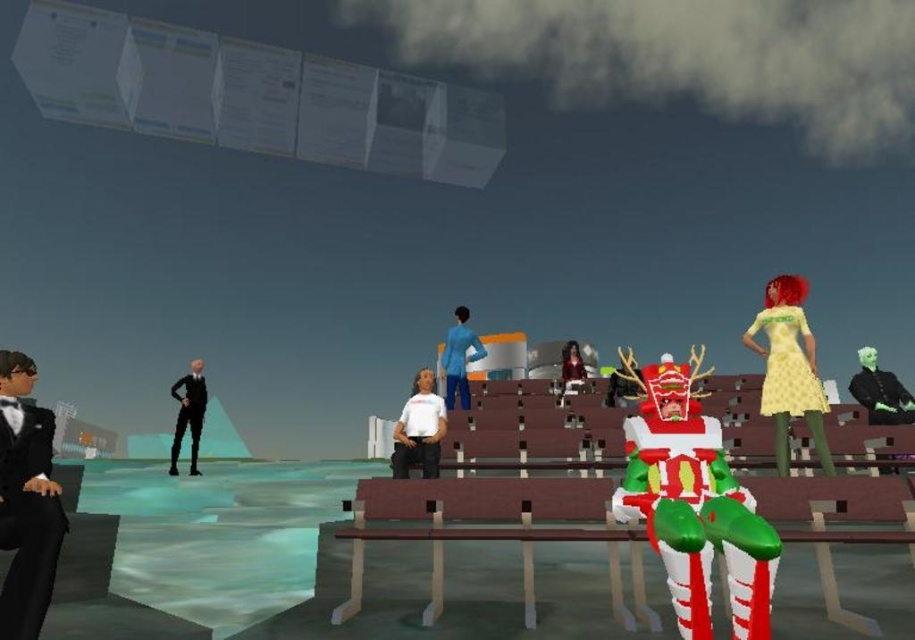
Does white matte shirt at center have a greater height compared to shiny black jacket at center?

Indeed, white matte shirt at center has a greater height compared to shiny black jacket at center.

In order to click on white matte shirt at center in this screenshot , I will do `click(418, 429)`.

Locate an element on the screen. The width and height of the screenshot is (915, 640). white matte shirt at center is located at coordinates (418, 429).

The width and height of the screenshot is (915, 640). I want to click on white matte shirt at center, so click(418, 429).

This screenshot has height=640, width=915. What do you see at coordinates (493, 531) in the screenshot?
I see `wooden bench at center` at bounding box center [493, 531].

In the scene shown: Is wooden bench at center to the left of yellow dotted dress at right from the viewer's perspective?

Indeed, wooden bench at center is positioned on the left side of yellow dotted dress at right.

In order to click on wooden bench at center in this screenshot , I will do `click(493, 531)`.

At what (x,y) coordinates should I click in order to perform the action: click on wooden bench at center. Please return your answer as a coordinate pair (x, y). The height and width of the screenshot is (640, 915). Looking at the image, I should click on (493, 531).

Which is in front, point (436, 576) or point (393, 436)?

Point (436, 576)

Looking at this image, does wooden bench at center have a larger size compared to white matte shirt at center?

Yes.

Which is in front, point (884, 531) or point (408, 406)?

Point (884, 531) is more forward.

What are the coordinates of `wooden bench at center` in the screenshot? It's located at (493, 531).